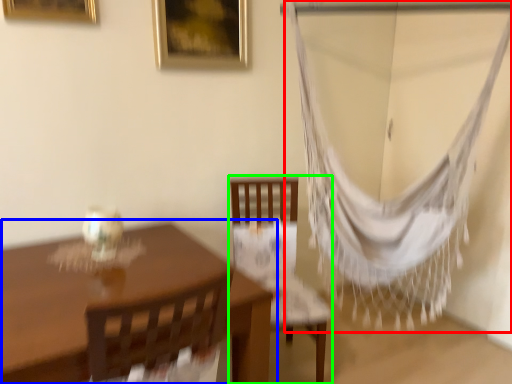
Question: Which object is the farthest from curtain (highlighted by a red box)? Choose among these: table (highlighted by a blue box) or chair (highlighted by a green box).

Choices:
 (A) table
 (B) chair

Answer: (A)